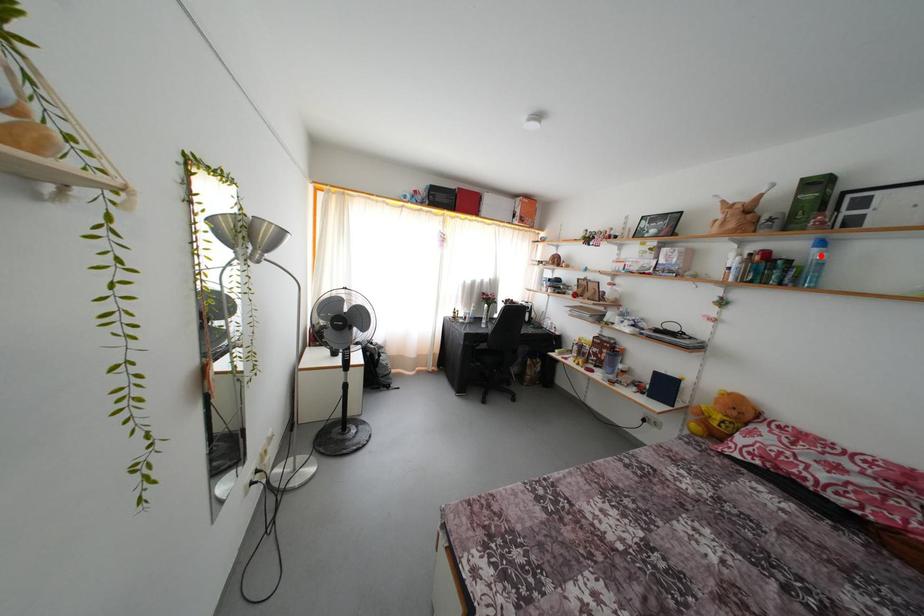
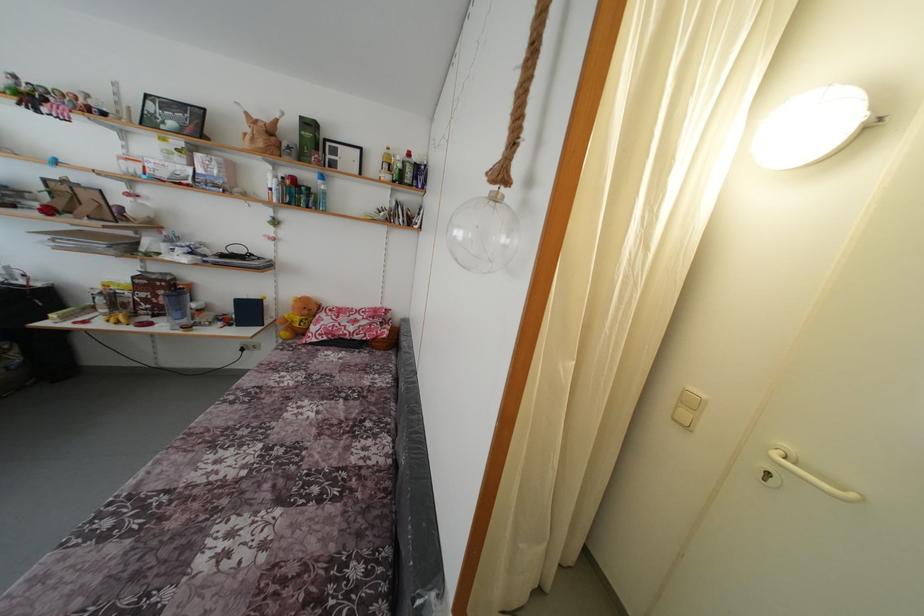
Question: A red point is marked in image1. In image2, is the corresponding 3D point closer to the camera or farther? Reply with the corresponding letter.

Choices:
 (A) The corresponding 3D point is closer.
 (B) The corresponding 3D point is farther.

Answer: (A)